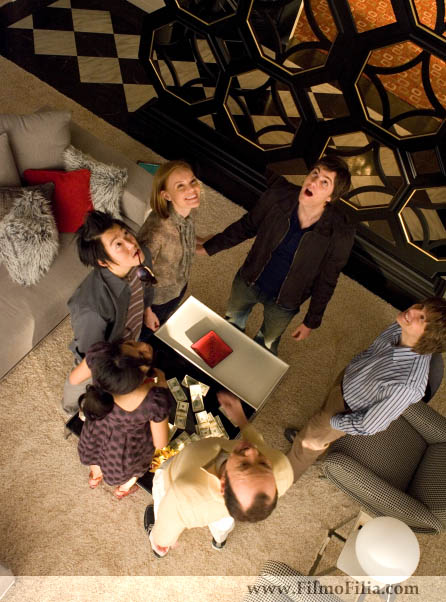
At what (x,y) coordinates should I click in order to perform the action: click on pillows. Please return your answer as a coordinate pair (x, y). This screenshot has height=602, width=446. Looking at the image, I should click on point(76,182), point(109,177), point(49,226).